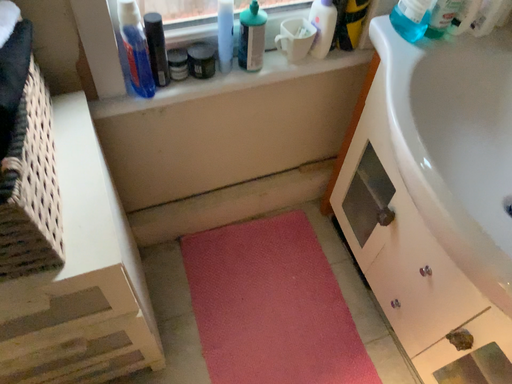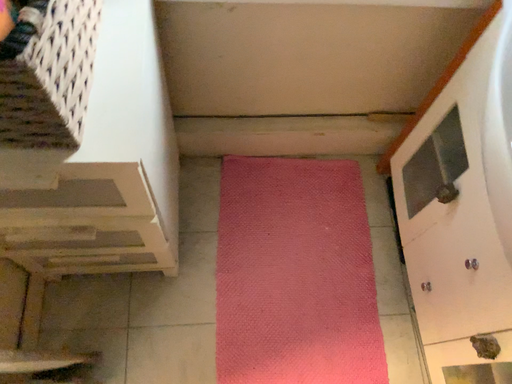
Question: How did the camera likely rotate when shooting the video?

Choices:
 (A) rotated right
 (B) rotated left

Answer: (B)